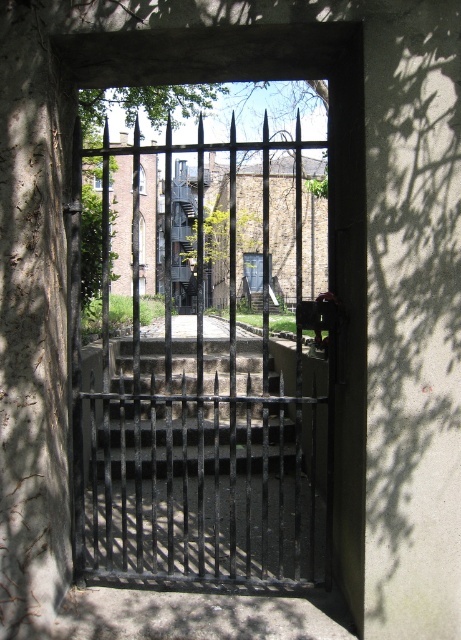
Question: Is green leafy tree at upper center wider than metallic gray staircase at center?

Choices:
 (A) no
 (B) yes

Answer: (A)

Question: Can you confirm if green leafy tree at upper center is positioned to the right of metallic gray staircase at center?

Choices:
 (A) yes
 (B) no

Answer: (A)

Question: Which point is closer to the camera?

Choices:
 (A) (84, 125)
 (B) (179, 272)

Answer: (A)

Question: Does green leafy tree at upper center have a greater width compared to metallic gray staircase at center?

Choices:
 (A) yes
 (B) no

Answer: (B)

Question: Which object is farther from the camera taking this photo?

Choices:
 (A) black wrought iron gate at center
 (B) metallic gray staircase at center

Answer: (B)

Question: Which object appears closest to the camera in this image?

Choices:
 (A) metallic gray staircase at center
 (B) black wrought iron gate at center

Answer: (B)